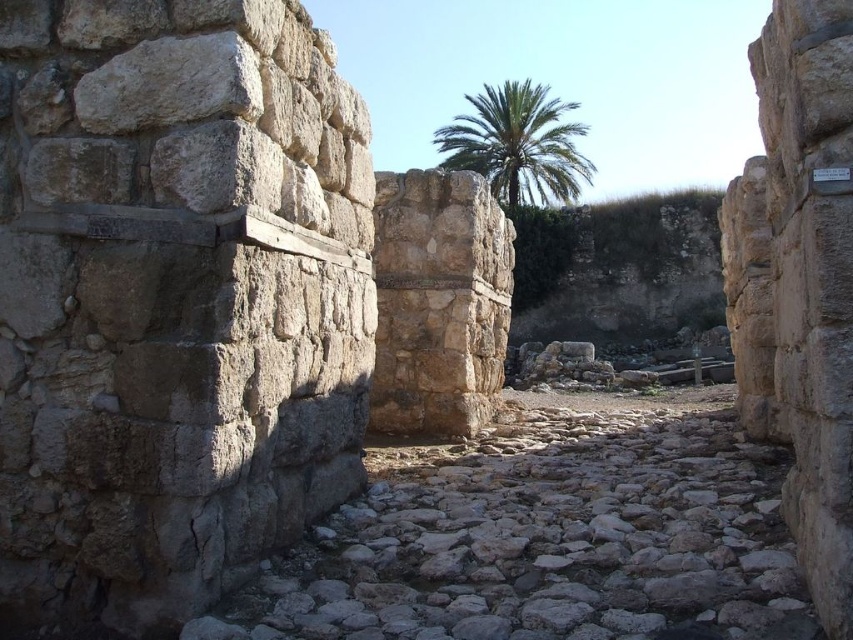
Question: Observing the image, what is the correct spatial positioning of yellowish stone wall at center in reference to white plastic sign at upper right?

Choices:
 (A) above
 (B) below

Answer: (A)

Question: Which object is positioned closest to the white plastic sign at upper right?

Choices:
 (A) green leafy palm at upper center
 (B) gray stone wall at center
 (C) yellowish stone wall at center

Answer: (C)

Question: Considering the real-world distances, which object is farthest from the gray stone wall at center?

Choices:
 (A) yellowish stone wall at center
 (B) white plastic sign at upper right

Answer: (A)

Question: Is gray stone wall at center above green leafy palm at upper center?

Choices:
 (A) no
 (B) yes

Answer: (A)

Question: Does gray stone wall at center lie behind yellowish stone wall at center?

Choices:
 (A) no
 (B) yes

Answer: (B)

Question: Among these points, which one is nearest to the camera?

Choices:
 (A) (821, 172)
 (B) (838, 300)

Answer: (B)